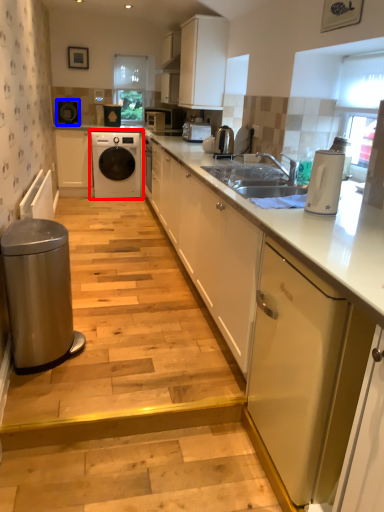
Question: Which point is further to the camera, washing machine (highlighted by a red box) or appliance (highlighted by a blue box)?

Choices:
 (A) washing machine
 (B) appliance

Answer: (A)